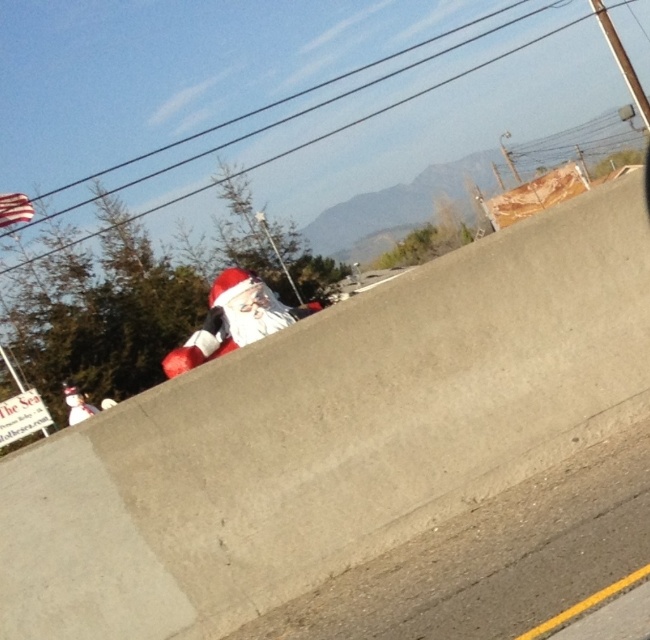
Question: Which point is farther to the camera?

Choices:
 (A) fuzzy red santa at center
 (B) white plush santa at lower left

Answer: (B)

Question: Does fuzzy red santa at center appear on the left side of white plush santa at lower left?

Choices:
 (A) yes
 (B) no

Answer: (B)

Question: Can you confirm if fuzzy red santa at center is bigger than white plush santa at lower left?

Choices:
 (A) yes
 (B) no

Answer: (A)

Question: Is fuzzy red santa at center bigger than white plush santa at lower left?

Choices:
 (A) no
 (B) yes

Answer: (B)